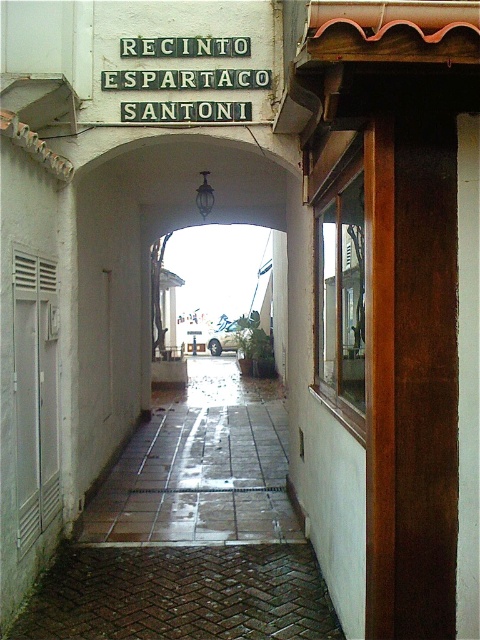
Is wet brick pavement at center thinner than metallic silver car at center?

In fact, wet brick pavement at center might be wider than metallic silver car at center.

Is wet brick pavement at center taller than metallic silver car at center?

In fact, wet brick pavement at center may be shorter than metallic silver car at center.

Between point (31, 628) and point (229, 336), which one is positioned behind?

The point (229, 336) is behind.

Find the location of `wet brick pavement at center`. wet brick pavement at center is located at coordinates (191, 531).

Is brown tile pavement at center wider than metallic silver car at center?

Correct, the width of brown tile pavement at center exceeds that of metallic silver car at center.

Who is more distant from viewer, (149, 461) or (216, 346)?

The point (216, 346) is behind.

Is point (230, 465) closer to camera compared to point (241, 330)?

Yes, it is in front of point (241, 330).

Find the location of a particular element. This screenshot has height=640, width=480. brown tile pavement at center is located at coordinates (202, 468).

From the picture: Does wet brick pavement at center have a greater width compared to green metal sign at upper center?

Correct, the width of wet brick pavement at center exceeds that of green metal sign at upper center.

Is point (285, 432) farther from camera compared to point (122, 115)?

That is True.

Image resolution: width=480 pixels, height=640 pixels. What do you see at coordinates (191, 531) in the screenshot? I see `wet brick pavement at center` at bounding box center [191, 531].

The width and height of the screenshot is (480, 640). I want to click on wet brick pavement at center, so click(x=191, y=531).